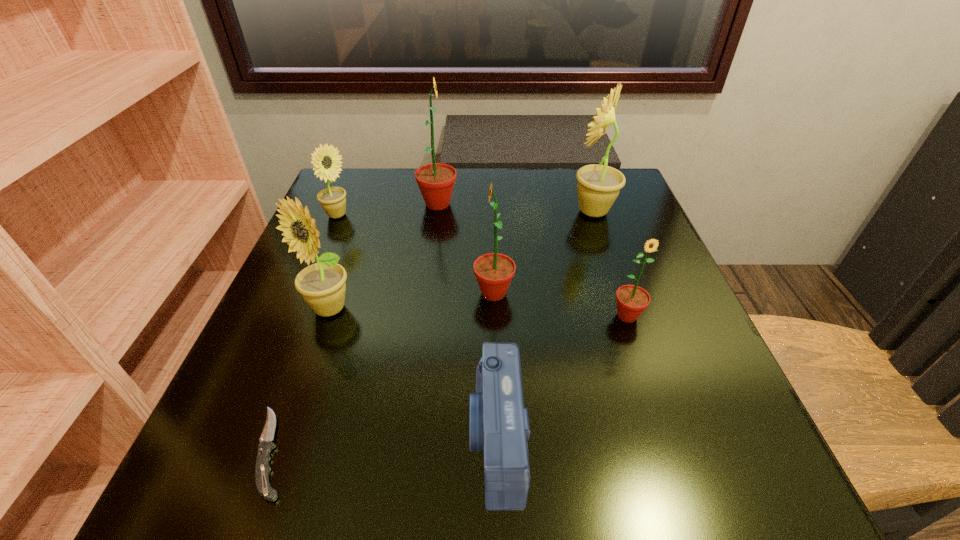
I want to click on vacant space at the far edge, so click(x=404, y=199).

This screenshot has width=960, height=540. Find the location of `free space at the left edge`. free space at the left edge is located at coordinates (305, 381).

Locate an element on the screen. vacant space at the right edge of the desktop is located at coordinates (645, 386).

I want to click on free space at the far left corner of the desktop, so click(343, 173).

In the image, there is a desktop. Where is `vacant space at the near left corner`? The width and height of the screenshot is (960, 540). vacant space at the near left corner is located at coordinates (230, 488).

In order to click on unoccupied position between the pocketknife and the seventh tallest object in this screenshot , I will do `click(384, 446)`.

Where is `empty space between the second biggest yellow sunflower and the shortest object`? The image size is (960, 540). empty space between the second biggest yellow sunflower and the shortest object is located at coordinates (300, 380).

Locate an element on the screen. Image resolution: width=960 pixels, height=540 pixels. vacant area that lies between the leftmost green sunflower and the smallest green sunflower is located at coordinates (533, 260).

Find the location of a particular element. This screenshot has width=960, height=540. free space that is in between the biggest yellow sunflower and the pocketknife is located at coordinates click(x=433, y=332).

At what (x,y) coordinates should I click in order to perform the action: click on free spot between the pocketknife and the farthest green sunflower. Please return your answer as a coordinate pair (x, y). The width and height of the screenshot is (960, 540). Looking at the image, I should click on (355, 328).